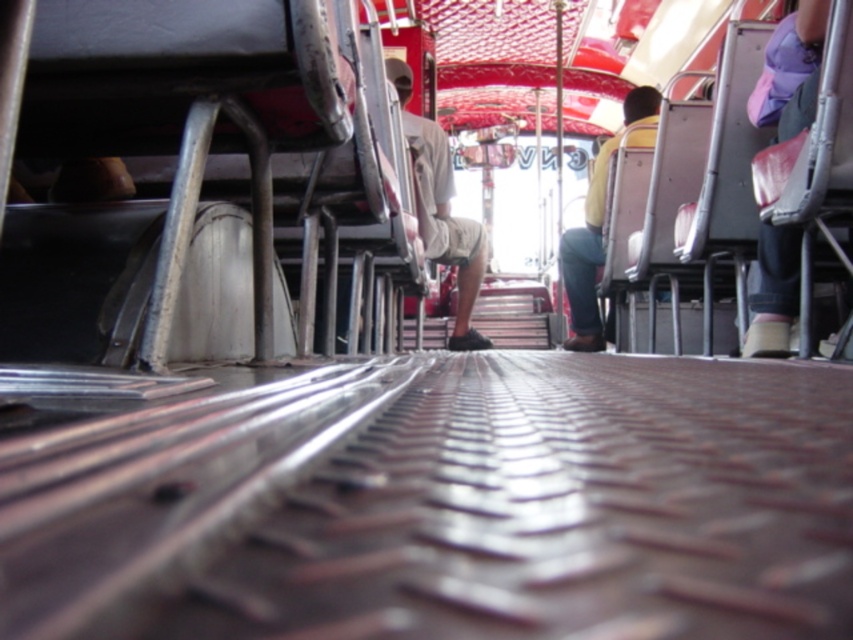
Question: Which object appears closest to the camera in this image?

Choices:
 (A) purple fabric cap at upper right
 (B) yellow fabric shirt at center
 (C) khaki shorts at center

Answer: (A)

Question: Is khaki shorts at center to the left of purple fabric cap at upper right from the viewer's perspective?

Choices:
 (A) yes
 (B) no

Answer: (A)

Question: Estimate the real-world distances between objects in this image. Which object is closer to the yellow fabric shirt at center?

Choices:
 (A) khaki shorts at center
 (B) purple fabric cap at upper right

Answer: (A)

Question: Can you confirm if khaki shorts at center is smaller than purple fabric cap at upper right?

Choices:
 (A) yes
 (B) no

Answer: (B)

Question: Which object is the closest to the purple fabric cap at upper right?

Choices:
 (A) yellow fabric shirt at center
 (B) khaki shorts at center

Answer: (B)

Question: Considering the relative positions of purple fabric cap at upper right and yellow fabric shirt at center in the image provided, where is purple fabric cap at upper right located with respect to yellow fabric shirt at center?

Choices:
 (A) below
 (B) above

Answer: (A)